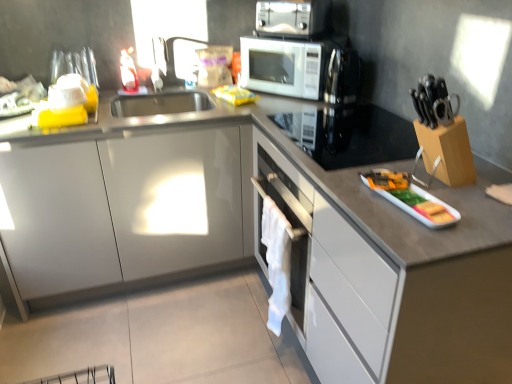
The width and height of the screenshot is (512, 384). What are the coordinates of `vacant area situated below white glossy tray at right, marked as the second appliance in a back-to-front arrangement (from a real-world perspective)` in the screenshot? It's located at (409, 203).